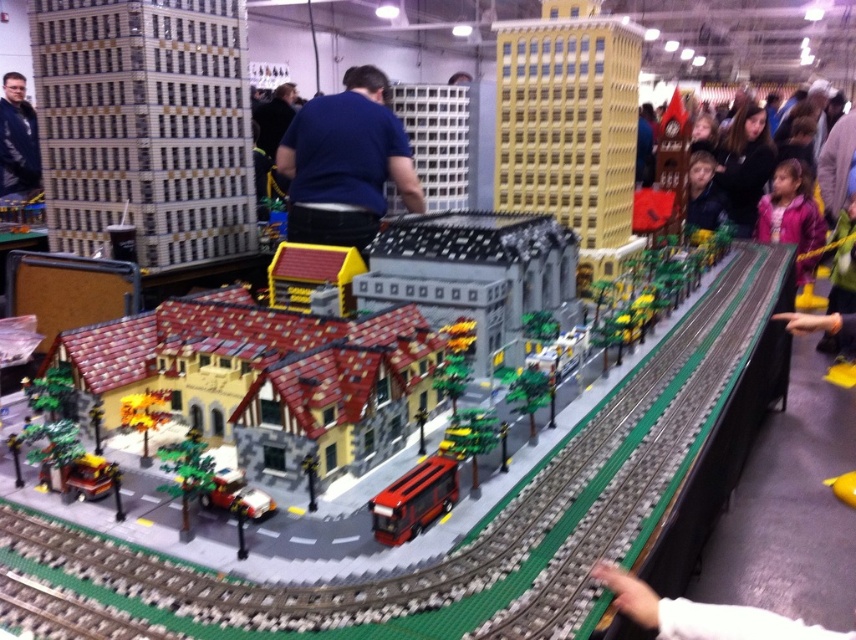
Who is higher up, blue fabric shirt at center or leather jacket at left?

leather jacket at left

Can you confirm if blue fabric shirt at center is positioned to the left of leather jacket at left?

Incorrect, blue fabric shirt at center is not on the left side of leather jacket at left.

The image size is (856, 640). What are the coordinates of `blue fabric shirt at center` in the screenshot? It's located at 345,163.

Is point (421, 480) closer to viewer compared to point (765, 230)?

Yes, it is in front of point (765, 230).

From the picture: Between shiny red bus at center and pink fleece jacket at upper right, which one is positioned lower?

shiny red bus at center

This screenshot has height=640, width=856. What are the coordinates of `shiny red bus at center` in the screenshot? It's located at (414, 499).

Looking at this image, can you confirm if shiny red bus at center is thinner than leather jacket at left?

Yes.

Where is `shiny red bus at center`? shiny red bus at center is located at coordinates (414, 499).